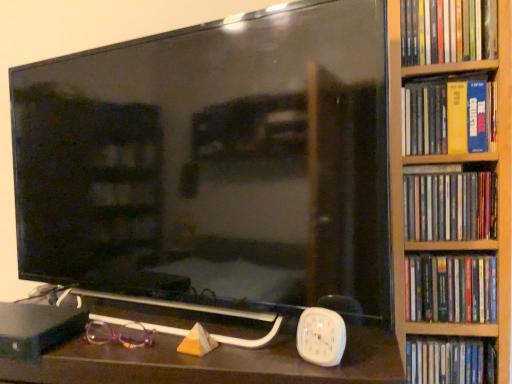
Question: Can black glossy tv at center be found inside white plastic clock at lower right?

Choices:
 (A) no
 (B) yes

Answer: (A)

Question: From a real-world perspective, is white plastic clock at lower right located beneath black glossy tv at center?

Choices:
 (A) yes
 (B) no

Answer: (A)

Question: Can you confirm if white plastic clock at lower right is smaller than black glossy tv at center?

Choices:
 (A) no
 (B) yes

Answer: (B)

Question: Can you confirm if white plastic clock at lower right is positioned to the right of black glossy tv at center?

Choices:
 (A) no
 (B) yes

Answer: (B)

Question: From the image's perspective, is white plastic clock at lower right on black glossy tv at center?

Choices:
 (A) yes
 (B) no

Answer: (B)

Question: In terms of height, does matte plastic book at right, the 5th book ordered from the bottom, look taller or shorter compared to matte plastic dvds at right, the third book when ordered from top to bottom?

Choices:
 (A) tall
 (B) short

Answer: (B)

Question: Does point (416, 6) appear closer or farther from the camera than point (424, 192)?

Choices:
 (A) closer
 (B) farther

Answer: (A)

Question: In terms of size, does matte plastic book at right, the 5th book ordered from the bottom, appear bigger or smaller than matte plastic dvds at right, which is the 3th book from bottom to top?

Choices:
 (A) small
 (B) big

Answer: (B)

Question: In the image, is matte plastic book at right, the 5th book ordered from the bottom, positioned in front of or behind matte plastic dvds at right, the third book when ordered from top to bottom?

Choices:
 (A) behind
 (B) front

Answer: (B)

Question: From the image's perspective, is white plastic clock at lower right positioned above or below matte plastic dvds at right, the third book when ordered from top to bottom?

Choices:
 (A) above
 (B) below

Answer: (B)

Question: Considering the positions of white plastic clock at lower right and matte plastic dvds at right, which is the 3th book from bottom to top, in the image, is white plastic clock at lower right wider or thinner than matte plastic dvds at right, which is the 3th book from bottom to top,?

Choices:
 (A) thin
 (B) wide

Answer: (A)

Question: From a real-world perspective, relative to matte plastic dvds at right, which is the 3th book from bottom to top, is white plastic clock at lower right vertically above or below?

Choices:
 (A) above
 (B) below

Answer: (B)

Question: Considering the positions of point (302, 317) and point (436, 231), is point (302, 317) closer or farther from the camera than point (436, 231)?

Choices:
 (A) farther
 (B) closer

Answer: (B)

Question: Would you say black glossy tv at center is to the left or to the right of purple plastic glasses at lower left in the picture?

Choices:
 (A) right
 (B) left

Answer: (A)

Question: From the image's perspective, is black glossy tv at center positioned above or below purple plastic glasses at lower left?

Choices:
 (A) above
 (B) below

Answer: (A)